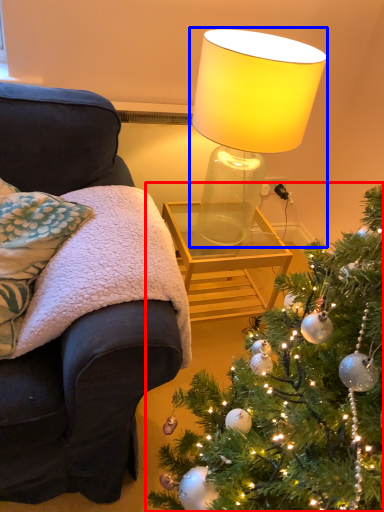
Question: Which object appears closest to the camera in this image, christmas tree (highlighted by a red box) or lamp (highlighted by a blue box)?

Choices:
 (A) christmas tree
 (B) lamp

Answer: (A)